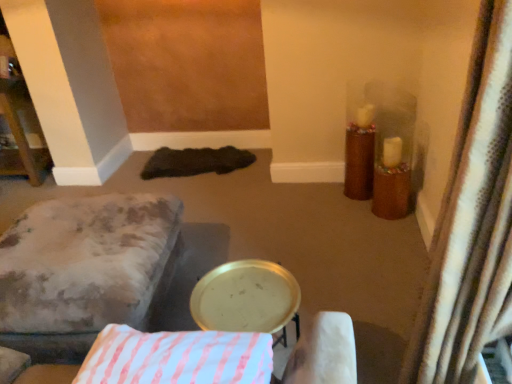
Question: Considering the positions of point (238, 369) and point (195, 321), is point (238, 369) closer or farther from the camera than point (195, 321)?

Choices:
 (A) farther
 (B) closer

Answer: (B)

Question: From a real-world perspective, relative to gold metallic tray at center, is white striped fabric pillow at center vertically above or below?

Choices:
 (A) below
 (B) above

Answer: (B)

Question: Estimate the real-world distances between objects in this image. Which object is farther from the white textured curtain at right?

Choices:
 (A) white striped fabric pillow at center
 (B) gold metallic tray at center
 (C) velvet-like beige ottoman at lower left

Answer: (C)

Question: Estimate the real-world distances between objects in this image. Which object is closer to the white striped fabric pillow at center?

Choices:
 (A) gold metallic tray at center
 (B) velvet-like beige ottoman at lower left
 (C) white textured curtain at right

Answer: (A)